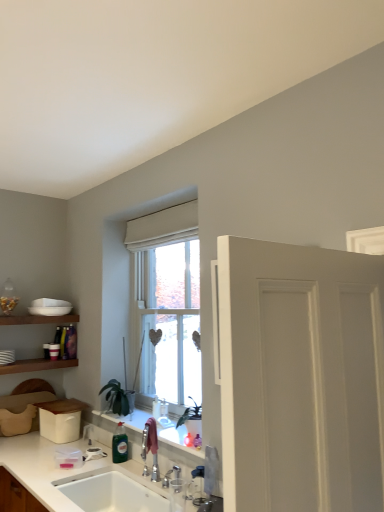
Question: From a real-world perspective, is green glass bottle at sink positioned above or below green matte plant at center?

Choices:
 (A) above
 (B) below

Answer: (B)

Question: Considering the positions of green glass bottle at sink and green matte plant at center in the image, is green glass bottle at sink wider or thinner than green matte plant at center?

Choices:
 (A) wide
 (B) thin

Answer: (B)

Question: Considering the real-world distances, which object is closest to the green glass bottle at sink?

Choices:
 (A) white matte door at right
 (B) white ceramic sink at lower left
 (C) green matte plant at center
 (D) white glossy countertop at lower center

Answer: (B)

Question: Based on their relative distances, which object is nearer to the green matte plant at center?

Choices:
 (A) white matte door at right
 (B) white ceramic sink at lower left
 (C) green glass bottle at sink
 (D) white glossy countertop at lower center

Answer: (C)